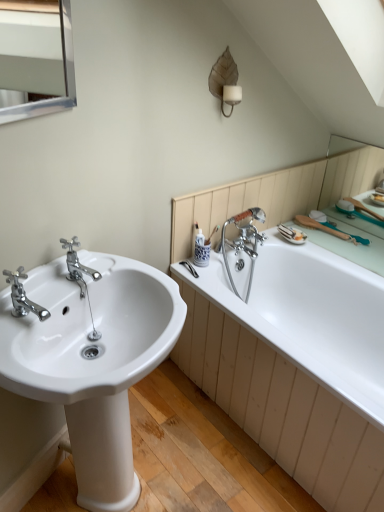
Question: Considering the relative sizes of white glossy bathtub at right and chrome metallic faucet at left, marked as the first tap in a front-to-back arrangement, in the image provided, is white glossy bathtub at right taller than chrome metallic faucet at left, marked as the first tap in a front-to-back arrangement,?

Choices:
 (A) no
 (B) yes

Answer: (B)

Question: From the image's perspective, is white glossy bathtub at right on top of chrome metallic faucet at left, marked as the first tap in a front-to-back arrangement?

Choices:
 (A) yes
 (B) no

Answer: (B)

Question: Can chrome metallic faucet at left, which appears as the 2th tap when viewed from the back, be found inside white glossy bathtub at right?

Choices:
 (A) no
 (B) yes

Answer: (A)

Question: Does white glossy bathtub at right have a smaller size compared to chrome metallic faucet at left, marked as the first tap in a front-to-back arrangement?

Choices:
 (A) no
 (B) yes

Answer: (A)

Question: Is white glossy bathtub at right wider than chrome metallic faucet at left, marked as the first tap in a front-to-back arrangement?

Choices:
 (A) yes
 (B) no

Answer: (A)

Question: Considering their positions, is silver metallic medicine cabinet at upper left located in front of or behind matte brown leaf-shaped sconce at upper center?

Choices:
 (A) front
 (B) behind

Answer: (A)

Question: Considering the positions of silver metallic medicine cabinet at upper left and matte brown leaf-shaped sconce at upper center in the image, is silver metallic medicine cabinet at upper left taller or shorter than matte brown leaf-shaped sconce at upper center?

Choices:
 (A) tall
 (B) short

Answer: (A)

Question: Is silver metallic medicine cabinet at upper left situated inside matte brown leaf-shaped sconce at upper center or outside?

Choices:
 (A) outside
 (B) inside

Answer: (A)

Question: Is point (3, 48) positioned closer to the camera than point (215, 66)?

Choices:
 (A) farther
 (B) closer

Answer: (A)

Question: In terms of size, does chrome metallic faucet at left, positioned as the 2th tap in front-to-back order, appear bigger or smaller than silver metallic medicine cabinet at upper left?

Choices:
 (A) big
 (B) small

Answer: (B)

Question: Does point (66, 246) appear closer or farther from the camera than point (44, 60)?

Choices:
 (A) closer
 (B) farther

Answer: (A)

Question: Is chrome metallic faucet at left, positioned as the 2th tap in front-to-back order, wider or thinner than silver metallic medicine cabinet at upper left?

Choices:
 (A) wide
 (B) thin

Answer: (A)

Question: Which is correct: chrome metallic faucet at left, positioned as the 2th tap in front-to-back order, is inside silver metallic medicine cabinet at upper left, or outside of it?

Choices:
 (A) inside
 (B) outside

Answer: (B)

Question: In the image, is chrome metallic faucet at left, marked as the first tap in a front-to-back arrangement, positioned in front of or behind matte brown leaf-shaped sconce at upper center?

Choices:
 (A) behind
 (B) front

Answer: (B)

Question: Looking at their shapes, would you say chrome metallic faucet at left, which appears as the 2th tap when viewed from the back, is wider or thinner than matte brown leaf-shaped sconce at upper center?

Choices:
 (A) thin
 (B) wide

Answer: (B)